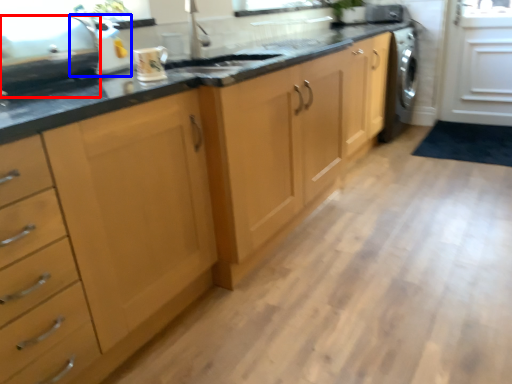
Question: Among these objects, which one is farthest to the camera, appliance (highlighted by a red box) or appliance (highlighted by a blue box)?

Choices:
 (A) appliance
 (B) appliance

Answer: (B)